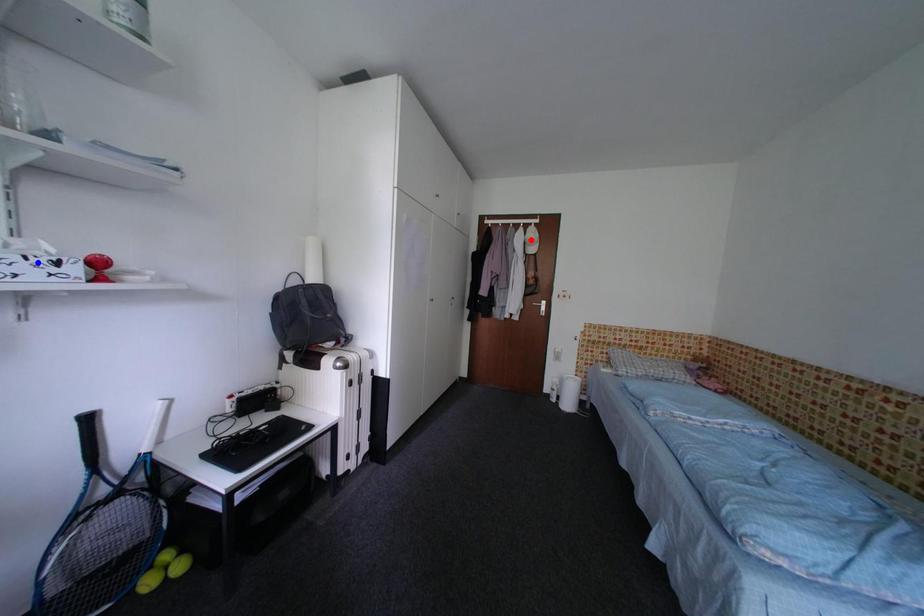
Question: Which of the two points in the image is closer to the camera?

Choices:
 (A) Blue point is closer.
 (B) Red point is closer.

Answer: (A)